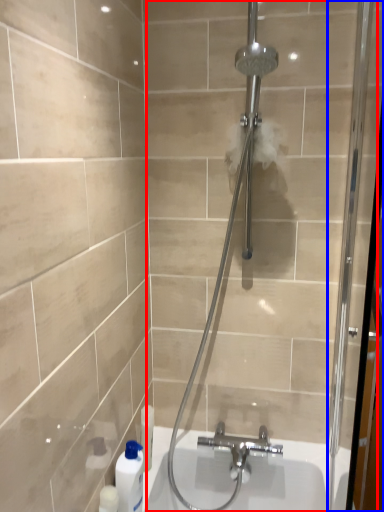
Question: Which object appears closest to the camera in this image, shower door (highlighted by a red box) or screen door (highlighted by a blue box)?

Choices:
 (A) shower door
 (B) screen door

Answer: (B)